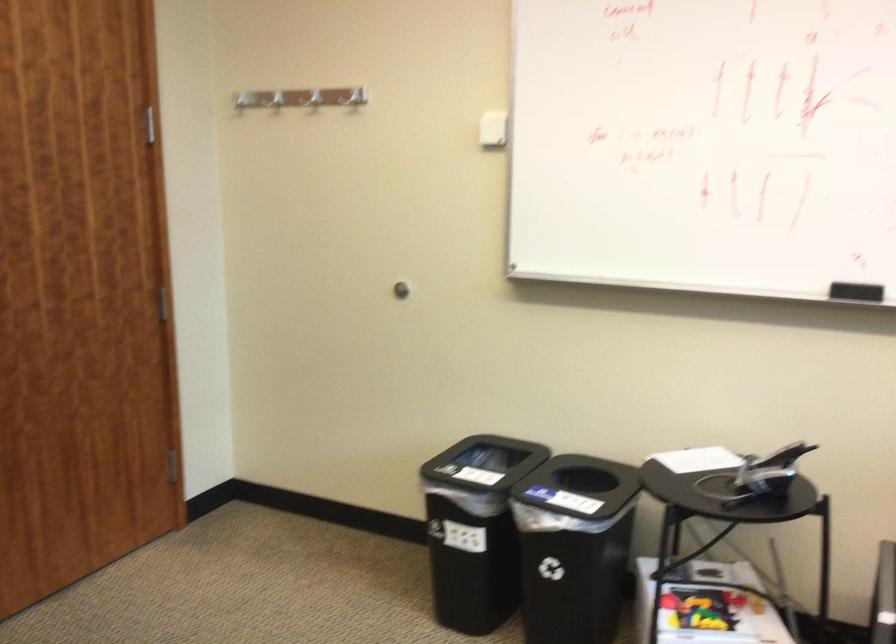
This screenshot has height=644, width=896. Describe the element at coordinates (493, 129) in the screenshot. I see `the white light switch` at that location.